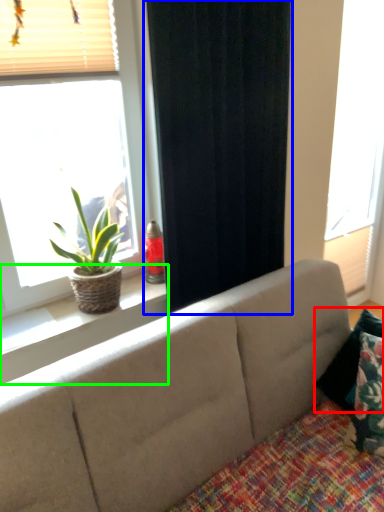
Question: Based on their relative distances, which object is nearer to pillow (highlighted by a red box)? Choose from curtain (highlighted by a blue box) and window sill (highlighted by a green box).

Choices:
 (A) curtain
 (B) window sill

Answer: (A)